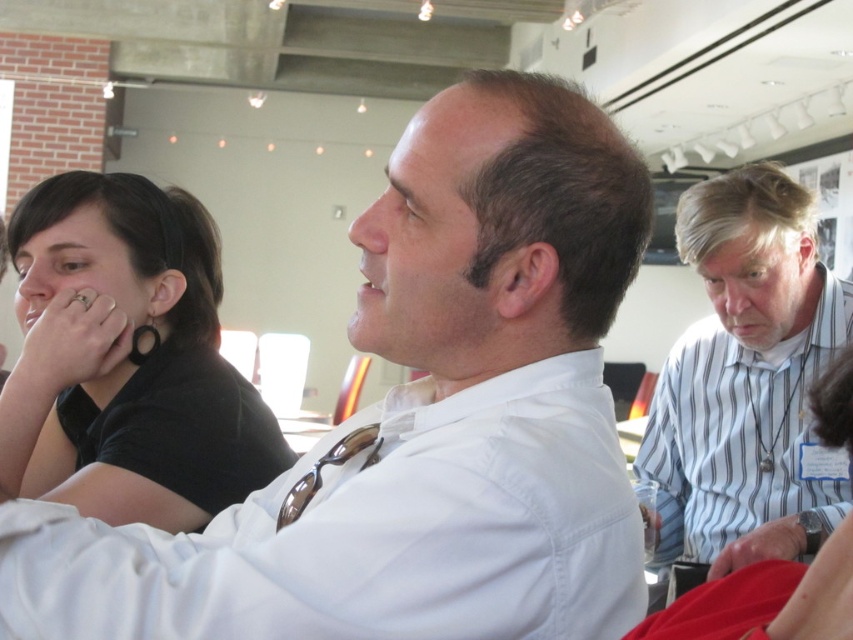
Can you confirm if white shirt at center is positioned below white striped shirt at right?

No, white shirt at center is not below white striped shirt at right.

Can you confirm if white shirt at center is wider than white striped shirt at right?

Yes.

Between point (560, 392) and point (793, 490), which one is positioned behind?

The point (793, 490) is behind.

Where is `white shirt at center`? The width and height of the screenshot is (853, 640). white shirt at center is located at coordinates (419, 420).

Is white shirt at center bigger than black matte shirt at left?

Yes, white shirt at center is bigger than black matte shirt at left.

Which is below, white shirt at center or black matte shirt at left?

white shirt at center

Does point (247, 547) come in front of point (258, 416)?

Yes, it is.

The width and height of the screenshot is (853, 640). In order to click on white shirt at center in this screenshot , I will do `click(419, 420)`.

Does black matte shirt at left have a lesser width compared to white striped shirt at right?

No, black matte shirt at left is not thinner than white striped shirt at right.

Image resolution: width=853 pixels, height=640 pixels. What do you see at coordinates (126, 358) in the screenshot? I see `black matte shirt at left` at bounding box center [126, 358].

Between point (281, 458) and point (717, 188), which one is positioned in front?

Positioned in front is point (281, 458).

I want to click on black matte shirt at left, so click(x=126, y=358).